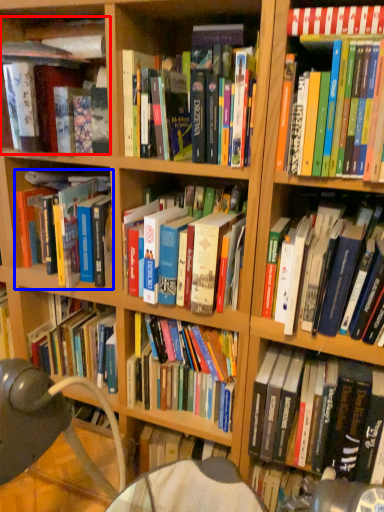
Question: Which object appears farthest to the camera in this image, book (highlighted by a red box) or book (highlighted by a blue box)?

Choices:
 (A) book
 (B) book

Answer: (B)